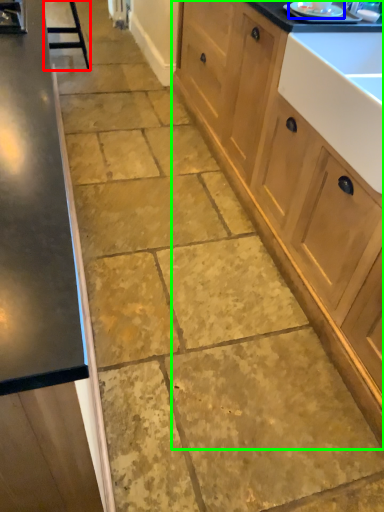
Question: Which object is positioned closest to bar stool (highlighted by a red box)? Select from appliance (highlighted by a blue box) and cabinetry (highlighted by a green box).

Choices:
 (A) appliance
 (B) cabinetry

Answer: (B)